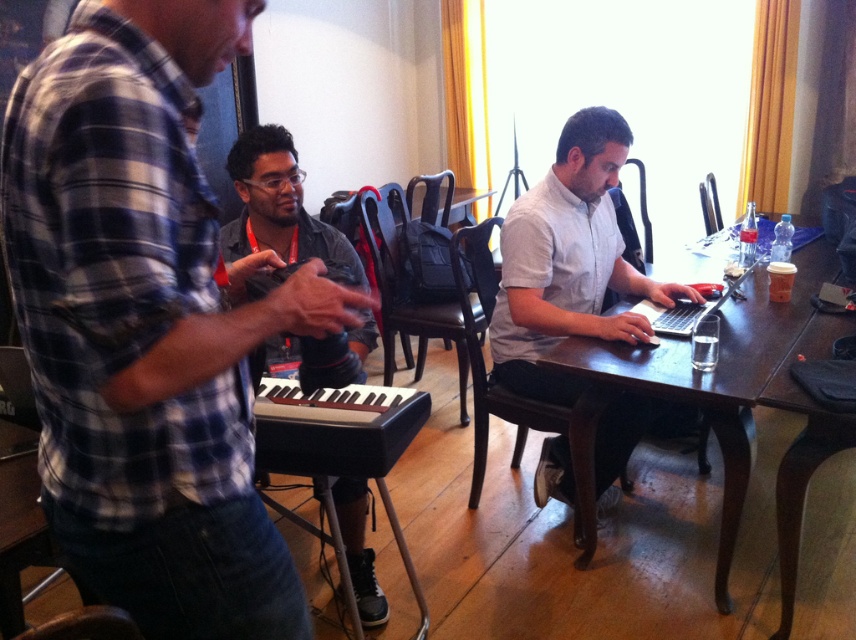
You are a photographer in the room and want to capture a photo of both the matte black keyboard at center and the silver metallic laptop at center without moving either device. Based on their distance, can you fit both into your camera frame at once?

The matte black keyboard at center is 38.78 inches away from the silver metallic laptop at center. Since the distance between them is 38.78 inches, it depends on your camera lens. A standard lens might require you to step back to include both, but if the camera has a wide enough angle, it could fit them in one shot.

Consider the image. You are standing in the room and want to place a small decorative item between the two points, point (x=569, y=401) and point (x=651, y=314). Which point should the item be closer to in order to appear larger in the camera view?

The item should be placed closer to point (x=569, y=401) because it is closer to the camera, making objects placed there appear larger in the camera view.

You are a photographer in the room and want to take a photo of the black leather piano at center and the silver metallic laptop at center. Which object should you focus on first if you want to capture both in the same frame without moving the camera?

The black leather piano at center is in front of the silver metallic laptop at center, so you should focus on the black leather piano at center first to ensure both are in focus.